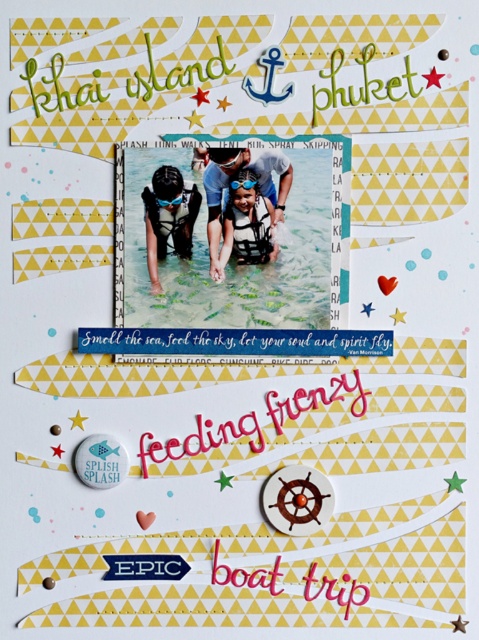
Which is more to the left, clear water at center or white life vest at center?

clear water at center

Does clear water at center appear on the right side of white life vest at center?

In fact, clear water at center is to the left of white life vest at center.

Who is more forward, (225, 300) or (246, 204)?

Positioned in front is point (246, 204).

I want to click on clear water at center, so click(x=232, y=256).

In the scene shown: Which is more to the left, clear water at center or matte green snorkel at center?

matte green snorkel at center is more to the left.

Is clear water at center smaller than matte green snorkel at center?

Incorrect, clear water at center is not smaller in size than matte green snorkel at center.

Between point (274, 296) and point (179, 221), which one is positioned in front?

Point (274, 296) is more forward.

This screenshot has height=640, width=479. I want to click on clear water at center, so click(x=232, y=256).

Is white life vest at center positioned in front of matte green snorkel at center?

Yes, white life vest at center is closer to the viewer.

This screenshot has width=479, height=640. Identify the location of white life vest at center. (247, 224).